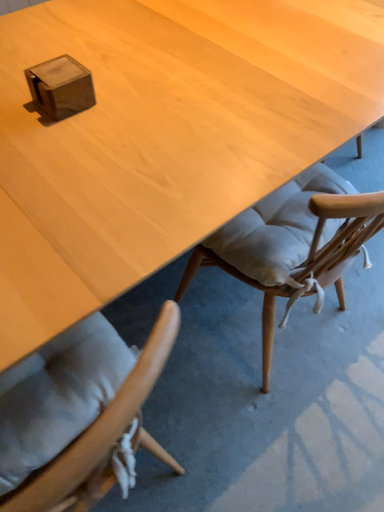
Locate an element on the screen. This screenshot has height=512, width=384. vacant area that is in front of light wood desk at center is located at coordinates (273, 430).